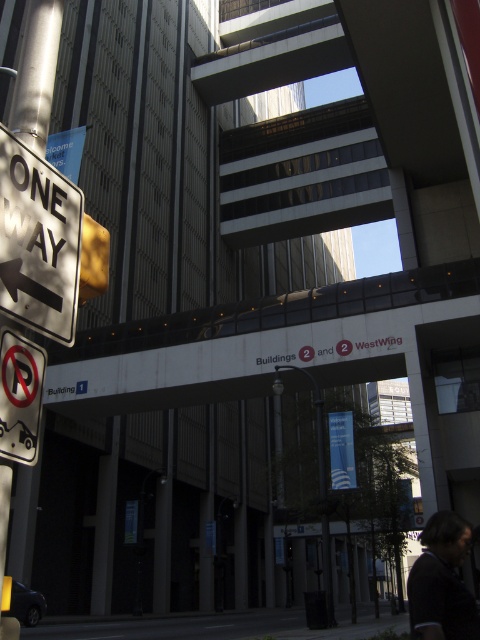
Question: Which point appears farthest from the camera in this image?

Choices:
 (A) (337, 337)
 (B) (29, 342)
 (C) (6, 310)

Answer: (A)

Question: Does white concrete overpass at center have a greater width compared to white plastic no-parking sign at lower left?

Choices:
 (A) no
 (B) yes

Answer: (B)

Question: Based on their relative distances, which object is nearer to the white plastic one-way sign at left?

Choices:
 (A) white plastic no-parking sign at lower left
 (B) white concrete overpass at center

Answer: (A)

Question: Does white concrete overpass at center have a lesser width compared to white plastic one-way sign at left?

Choices:
 (A) yes
 (B) no

Answer: (B)

Question: Is white concrete overpass at center thinner than white plastic no-parking sign at lower left?

Choices:
 (A) yes
 (B) no

Answer: (B)

Question: Among these objects, which one is nearest to the camera?

Choices:
 (A) white plastic no-parking sign at lower left
 (B) white concrete overpass at center
 (C) white plastic one-way sign at left

Answer: (A)